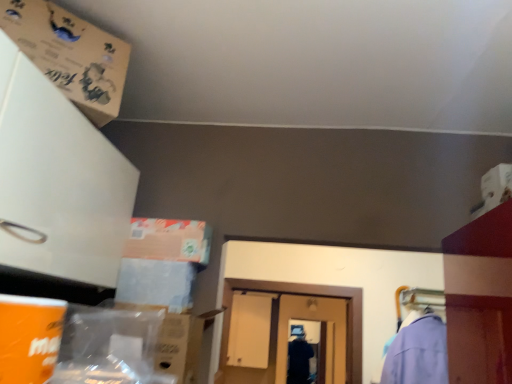
The image size is (512, 384). What do you see at coordinates (175, 342) in the screenshot?
I see `matte cardboard box at lower left, which is the 2th cardboard box in top-to-bottom order` at bounding box center [175, 342].

You are a GUI agent. You are given a task and a screenshot of the screen. Output one action in this format:
    pyautogui.click(x=<x>, y=<y>)
    Task: Click on the matte cardboard box at lower left, which is the 2th cardboard box in top-to-bottom order
    
    Given the screenshot: What is the action you would take?
    pyautogui.click(x=175, y=342)

In order to face brown cardboard box at upper left, which appears as the first cardboard box when viewed from the top, should I rotate leftwards or rightwards?

Turn left by 25.149 degrees to look at brown cardboard box at upper left, which appears as the first cardboard box when viewed from the top.

What is the approximate width of brown cardboard box at upper left, marked as the 2th cardboard box in a bottom-to-top arrangement?

It is 8.78 inches.

Image resolution: width=512 pixels, height=384 pixels. What do you see at coordinates (70, 55) in the screenshot?
I see `brown cardboard box at upper left, marked as the 2th cardboard box in a bottom-to-top arrangement` at bounding box center [70, 55].

The height and width of the screenshot is (384, 512). I want to click on brown cardboard box at upper left, which appears as the first cardboard box when viewed from the top, so click(x=70, y=55).

Image resolution: width=512 pixels, height=384 pixels. Identify the location of matte cardboard box at lower left, which is the 2th cardboard box in top-to-bottom order. (175, 342).

Considering the positions of objects brown cardboard box at upper left, marked as the 2th cardboard box in a bottom-to-top arrangement, and matte cardboard box at lower left, arranged as the first cardboard box when ordered from the bottom, in the image provided, who is more to the left, brown cardboard box at upper left, marked as the 2th cardboard box in a bottom-to-top arrangement, or matte cardboard box at lower left, arranged as the first cardboard box when ordered from the bottom,?

brown cardboard box at upper left, marked as the 2th cardboard box in a bottom-to-top arrangement.

Between brown cardboard box at upper left, which appears as the first cardboard box when viewed from the top, and matte cardboard box at lower left, which is the 2th cardboard box in top-to-bottom order, which one is positioned in front?

brown cardboard box at upper left, which appears as the first cardboard box when viewed from the top, is more forward.

Which is in front, point (29, 38) or point (166, 367)?

The point (29, 38) is in front.

From the image's perspective, who appears lower, brown cardboard box at upper left, marked as the 2th cardboard box in a bottom-to-top arrangement, or matte cardboard box at lower left, which is the 2th cardboard box in top-to-bottom order?

matte cardboard box at lower left, which is the 2th cardboard box in top-to-bottom order, from the image's perspective.

From a real-world perspective, which object stands above the other?

brown cardboard box at upper left, marked as the 2th cardboard box in a bottom-to-top arrangement, from a real-world perspective.

Which object is thinner, brown cardboard box at upper left, which appears as the first cardboard box when viewed from the top, or matte cardboard box at lower left, which is the 2th cardboard box in top-to-bottom order?

With smaller width is brown cardboard box at upper left, which appears as the first cardboard box when viewed from the top.

Considering the relative sizes of brown cardboard box at upper left, which appears as the first cardboard box when viewed from the top, and matte cardboard box at lower left, arranged as the first cardboard box when ordered from the bottom, in the image provided, is brown cardboard box at upper left, which appears as the first cardboard box when viewed from the top, shorter than matte cardboard box at lower left, arranged as the first cardboard box when ordered from the bottom,?

Correct, brown cardboard box at upper left, which appears as the first cardboard box when viewed from the top, is not as tall as matte cardboard box at lower left, arranged as the first cardboard box when ordered from the bottom.

Considering the sizes of brown cardboard box at upper left, which appears as the first cardboard box when viewed from the top, and matte cardboard box at lower left, which is the 2th cardboard box in top-to-bottom order, in the image, is brown cardboard box at upper left, which appears as the first cardboard box when viewed from the top, bigger or smaller than matte cardboard box at lower left, which is the 2th cardboard box in top-to-bottom order,?

Clearly, brown cardboard box at upper left, which appears as the first cardboard box when viewed from the top, is smaller in size than matte cardboard box at lower left, which is the 2th cardboard box in top-to-bottom order.

Looking at this image, is brown cardboard box at upper left, marked as the 2th cardboard box in a bottom-to-top arrangement, inside or outside of matte cardboard box at lower left, which is the 2th cardboard box in top-to-bottom order?

brown cardboard box at upper left, marked as the 2th cardboard box in a bottom-to-top arrangement, is outside matte cardboard box at lower left, which is the 2th cardboard box in top-to-bottom order.

Is brown cardboard box at upper left, which appears as the first cardboard box when viewed from the top, next to matte cardboard box at lower left, which is the 2th cardboard box in top-to-bottom order, and touching it?

No, brown cardboard box at upper left, which appears as the first cardboard box when viewed from the top, is not beside matte cardboard box at lower left, which is the 2th cardboard box in top-to-bottom order.

Is brown cardboard box at upper left, marked as the 2th cardboard box in a bottom-to-top arrangement, facing away from matte cardboard box at lower left, which is the 2th cardboard box in top-to-bottom order?

No, brown cardboard box at upper left, marked as the 2th cardboard box in a bottom-to-top arrangement, is not facing the opposite direction of matte cardboard box at lower left, which is the 2th cardboard box in top-to-bottom order.

What's the angular difference between brown cardboard box at upper left, marked as the 2th cardboard box in a bottom-to-top arrangement, and matte cardboard box at lower left, which is the 2th cardboard box in top-to-bottom order,'s facing directions?

43.5 degrees separate the facing orientations of brown cardboard box at upper left, marked as the 2th cardboard box in a bottom-to-top arrangement, and matte cardboard box at lower left, which is the 2th cardboard box in top-to-bottom order.

The image size is (512, 384). I want to click on cardboard box that is under the brown cardboard box at upper left, which appears as the first cardboard box when viewed from the top (from a real-world perspective), so click(x=175, y=342).

Does matte cardboard box at lower left, which is the 2th cardboard box in top-to-bottom order, appear on the left side of brown cardboard box at upper left, marked as the 2th cardboard box in a bottom-to-top arrangement?

No.

Which is behind, matte cardboard box at lower left, arranged as the first cardboard box when ordered from the bottom, or brown cardboard box at upper left, which appears as the first cardboard box when viewed from the top?

matte cardboard box at lower left, arranged as the first cardboard box when ordered from the bottom, is further from the camera.

Is point (192, 345) closer or farther from the camera than point (97, 76)?

Point (192, 345) is farther from the camera than point (97, 76).

From the image's perspective, relative to brown cardboard box at upper left, which appears as the first cardboard box when viewed from the top, is matte cardboard box at lower left, which is the 2th cardboard box in top-to-bottom order, above or below?

matte cardboard box at lower left, which is the 2th cardboard box in top-to-bottom order, is situated lower than brown cardboard box at upper left, which appears as the first cardboard box when viewed from the top, in the image.

From a real-world perspective, who is located lower, matte cardboard box at lower left, which is the 2th cardboard box in top-to-bottom order, or brown cardboard box at upper left, marked as the 2th cardboard box in a bottom-to-top arrangement?

In real-world perspective, matte cardboard box at lower left, which is the 2th cardboard box in top-to-bottom order, is lower.

Does matte cardboard box at lower left, arranged as the first cardboard box when ordered from the bottom, have a greater width compared to brown cardboard box at upper left, which appears as the first cardboard box when viewed from the top?

Yes, matte cardboard box at lower left, arranged as the first cardboard box when ordered from the bottom, is wider than brown cardboard box at upper left, which appears as the first cardboard box when viewed from the top.

Consider the image. Which of these two, matte cardboard box at lower left, arranged as the first cardboard box when ordered from the bottom, or brown cardboard box at upper left, which appears as the first cardboard box when viewed from the top, stands taller?

matte cardboard box at lower left, arranged as the first cardboard box when ordered from the bottom.

Considering the sizes of objects matte cardboard box at lower left, arranged as the first cardboard box when ordered from the bottom, and brown cardboard box at upper left, marked as the 2th cardboard box in a bottom-to-top arrangement, in the image provided, who is smaller, matte cardboard box at lower left, arranged as the first cardboard box when ordered from the bottom, or brown cardboard box at upper left, marked as the 2th cardboard box in a bottom-to-top arrangement,?

brown cardboard box at upper left, marked as the 2th cardboard box in a bottom-to-top arrangement, is smaller.

Is matte cardboard box at lower left, which is the 2th cardboard box in top-to-bottom order, inside or outside of brown cardboard box at upper left, which appears as the first cardboard box when viewed from the top?

matte cardboard box at lower left, which is the 2th cardboard box in top-to-bottom order, cannot be found inside brown cardboard box at upper left, which appears as the first cardboard box when viewed from the top.

Does matte cardboard box at lower left, arranged as the first cardboard box when ordered from the bottom, touch brown cardboard box at upper left, which appears as the first cardboard box when viewed from the top?

No, matte cardboard box at lower left, arranged as the first cardboard box when ordered from the bottom, is not in contact with brown cardboard box at upper left, which appears as the first cardboard box when viewed from the top.

Is brown cardboard box at upper left, which appears as the first cardboard box when viewed from the top, at the back of matte cardboard box at lower left, which is the 2th cardboard box in top-to-bottom order?

matte cardboard box at lower left, which is the 2th cardboard box in top-to-bottom order, is not turned away from brown cardboard box at upper left, which appears as the first cardboard box when viewed from the top.

How many degrees apart are the facing directions of matte cardboard box at lower left, arranged as the first cardboard box when ordered from the bottom, and brown cardboard box at upper left, which appears as the first cardboard box when viewed from the top?

matte cardboard box at lower left, arranged as the first cardboard box when ordered from the bottom, and brown cardboard box at upper left, which appears as the first cardboard box when viewed from the top, are facing 43.5 degrees away from each other.

Could you measure the distance between matte cardboard box at lower left, arranged as the first cardboard box when ordered from the bottom, and brown cardboard box at upper left, marked as the 2th cardboard box in a bottom-to-top arrangement?

They are 61.78 centimeters apart.

I want to click on cardboard box below the brown cardboard box at upper left, which appears as the first cardboard box when viewed from the top (from the image's perspective), so click(175, 342).

You are a GUI agent. You are given a task and a screenshot of the screen. Output one action in this format:
    pyautogui.click(x=<x>, y=<y>)
    Task: Click on the cardboard box located on the left of matte cardboard box at lower left, arranged as the first cardboard box when ordered from the bottom
    The width and height of the screenshot is (512, 384).
    Given the screenshot: What is the action you would take?
    pyautogui.click(x=70, y=55)

The height and width of the screenshot is (384, 512). What are the coordinates of `cardboard box above the matte cardboard box at lower left, arranged as the first cardboard box when ordered from the bottom (from a real-world perspective)` in the screenshot? It's located at (70, 55).